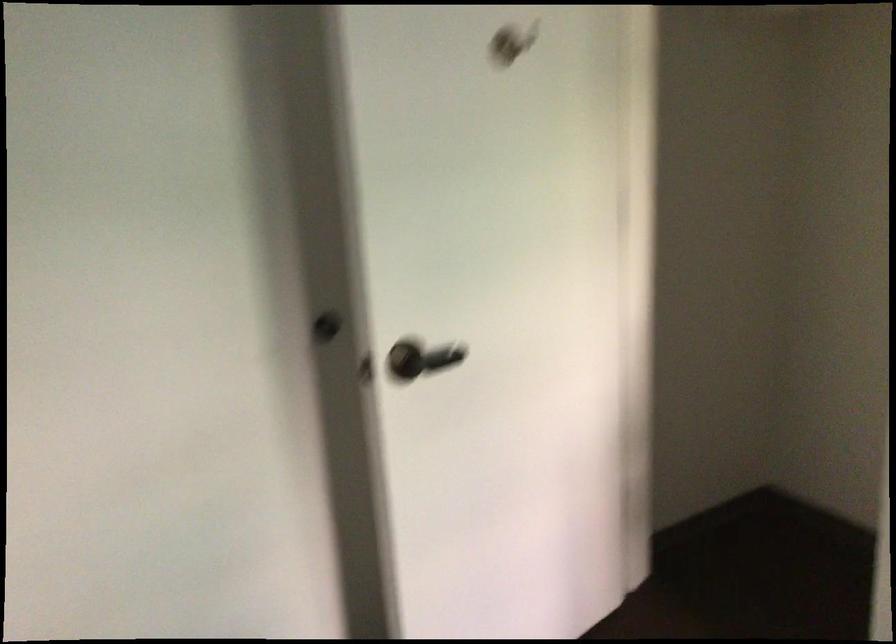
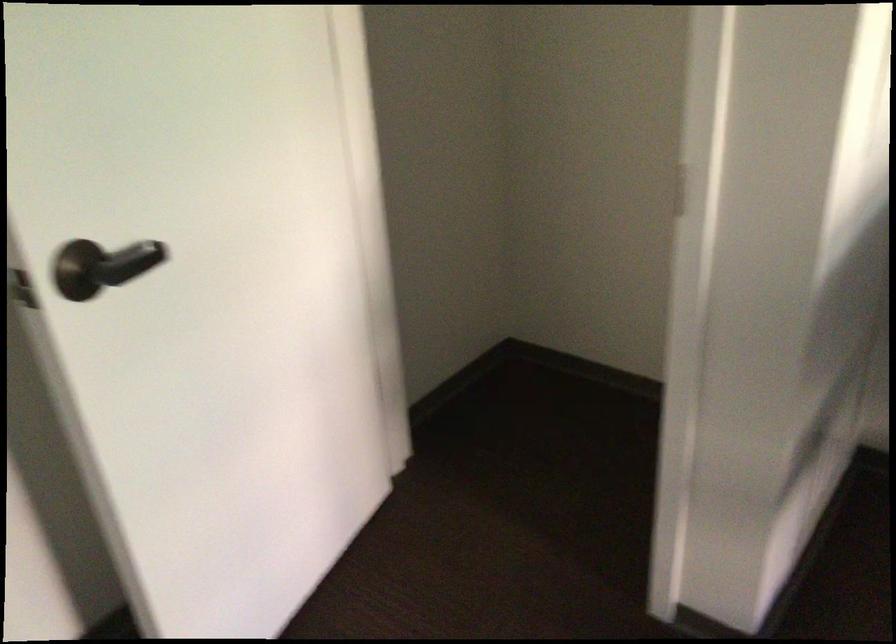
Question: In a continuous first-person perspective shot, in which direction is the camera moving?

Choices:
 (A) Left
 (B) Right
 (C) Forward
 (D) Backward

Answer: (C)